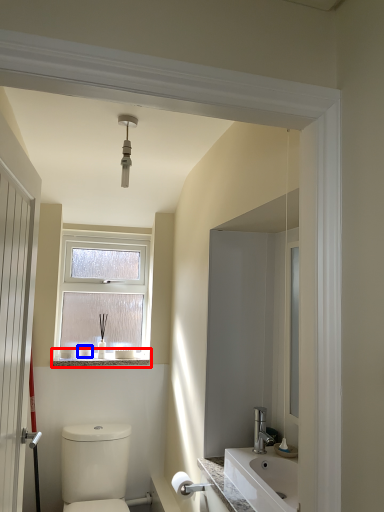
Question: Which object is further to the camera taking this photo, window sill (highlighted by a red box) or toiletry (highlighted by a blue box)?

Choices:
 (A) window sill
 (B) toiletry

Answer: (B)